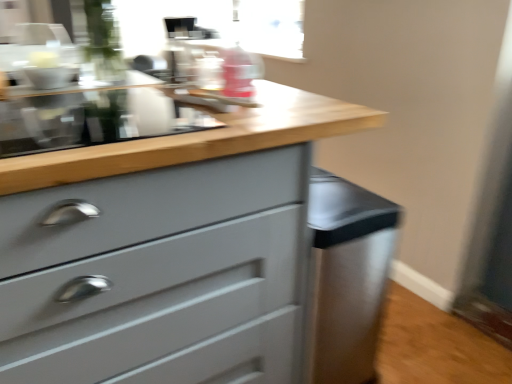
Question: Considering the positions of point (x=392, y=215) and point (x=141, y=344), is point (x=392, y=215) closer or farther from the camera than point (x=141, y=344)?

Choices:
 (A) closer
 (B) farther

Answer: (B)

Question: From a real-world perspective, is satin silver cabinet at lower right positioned above or below matte gray chest of drawers at center?

Choices:
 (A) below
 (B) above

Answer: (A)

Question: Is satin silver cabinet at lower right taller or shorter than matte gray chest of drawers at center?

Choices:
 (A) short
 (B) tall

Answer: (A)

Question: Considering their positions, is matte gray chest of drawers at center located in front of or behind satin silver cabinet at lower right?

Choices:
 (A) front
 (B) behind

Answer: (A)

Question: In the image, is matte gray chest of drawers at center on the left side or the right side of satin silver cabinet at lower right?

Choices:
 (A) right
 (B) left

Answer: (B)

Question: Considering the positions of matte gray chest of drawers at center and satin silver cabinet at lower right in the image, is matte gray chest of drawers at center wider or thinner than satin silver cabinet at lower right?

Choices:
 (A) wide
 (B) thin

Answer: (A)

Question: Would you say matte gray chest of drawers at center is inside or outside satin silver cabinet at lower right?

Choices:
 (A) outside
 (B) inside

Answer: (A)